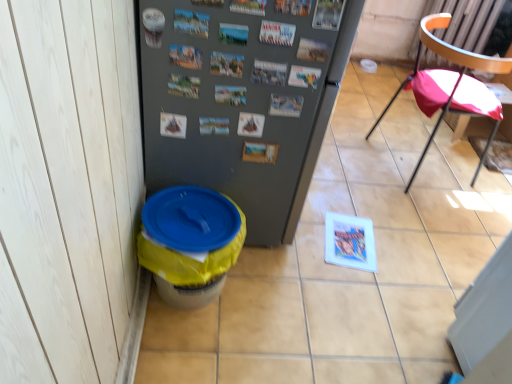
Question: Is gray matte refrigerator at center facing away from pink fabric chair at right?

Choices:
 (A) no
 (B) yes

Answer: (A)

Question: Are gray matte refrigerator at center and pink fabric chair at right far apart?

Choices:
 (A) no
 (B) yes

Answer: (B)

Question: From a real-world perspective, is gray matte refrigerator at center physically above pink fabric chair at right?

Choices:
 (A) no
 (B) yes

Answer: (B)

Question: From the image's perspective, is gray matte refrigerator at center under pink fabric chair at right?

Choices:
 (A) yes
 (B) no

Answer: (A)

Question: Considering the relative sizes of gray matte refrigerator at center and pink fabric chair at right in the image provided, is gray matte refrigerator at center smaller than pink fabric chair at right?

Choices:
 (A) yes
 (B) no

Answer: (B)

Question: Is gray matte refrigerator at center wider or thinner than yellow plastic trash can at lower left?

Choices:
 (A) wide
 (B) thin

Answer: (B)

Question: Would you say gray matte refrigerator at center is to the left or to the right of yellow plastic trash can at lower left in the picture?

Choices:
 (A) right
 (B) left

Answer: (B)

Question: In the image, is gray matte refrigerator at center positioned in front of or behind yellow plastic trash can at lower left?

Choices:
 (A) behind
 (B) front

Answer: (B)

Question: Is gray matte refrigerator at center bigger or smaller than yellow plastic trash can at lower left?

Choices:
 (A) big
 (B) small

Answer: (A)

Question: Considering the positions of yellow plastic potty at lower left and gray matte refrigerator at center in the image, is yellow plastic potty at lower left wider or thinner than gray matte refrigerator at center?

Choices:
 (A) thin
 (B) wide

Answer: (A)

Question: From the image's perspective, is yellow plastic potty at lower left positioned above or below gray matte refrigerator at center?

Choices:
 (A) above
 (B) below

Answer: (B)

Question: Looking at the image, does yellow plastic potty at lower left seem bigger or smaller compared to gray matte refrigerator at center?

Choices:
 (A) small
 (B) big

Answer: (A)

Question: From a real-world perspective, is yellow plastic potty at lower left physically located above or below gray matte refrigerator at center?

Choices:
 (A) above
 (B) below

Answer: (B)

Question: Is gray matte refrigerator at center taller or shorter than yellow plastic potty at lower left?

Choices:
 (A) short
 (B) tall

Answer: (B)

Question: From the image's perspective, relative to yellow plastic potty at lower left, is gray matte refrigerator at center above or below?

Choices:
 (A) above
 (B) below

Answer: (A)